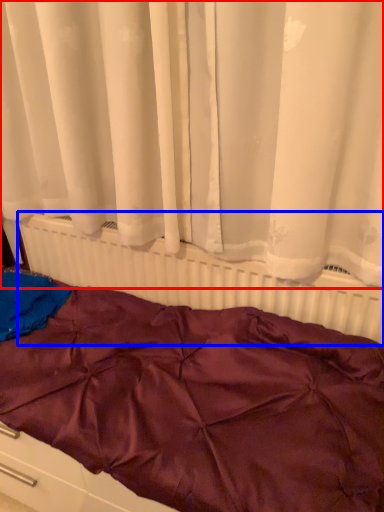
Question: Which of the following is the farthest to the observer, curtain (highlighted by a red box) or radiator (highlighted by a blue box)?

Choices:
 (A) curtain
 (B) radiator

Answer: (B)